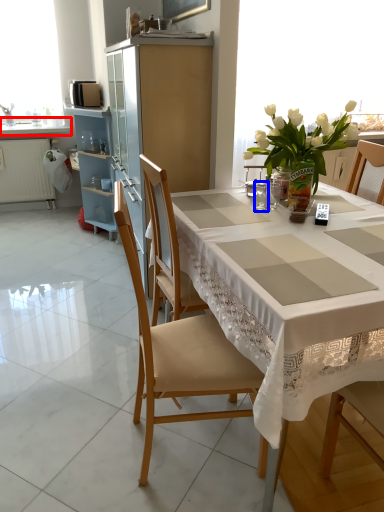
Question: Which object appears farthest to the camera in this image, countertop (highlighted by a red box) or tableware (highlighted by a blue box)?

Choices:
 (A) countertop
 (B) tableware

Answer: (A)